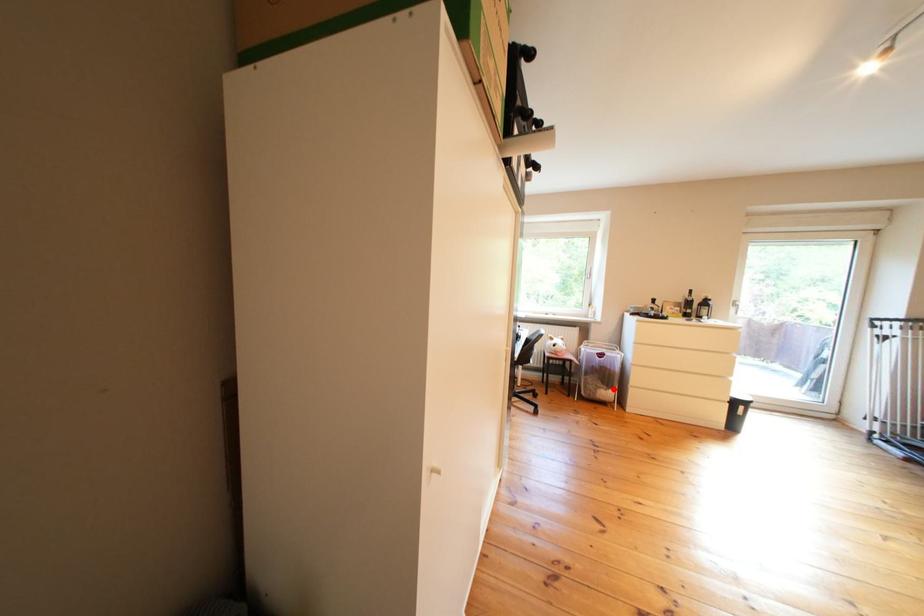
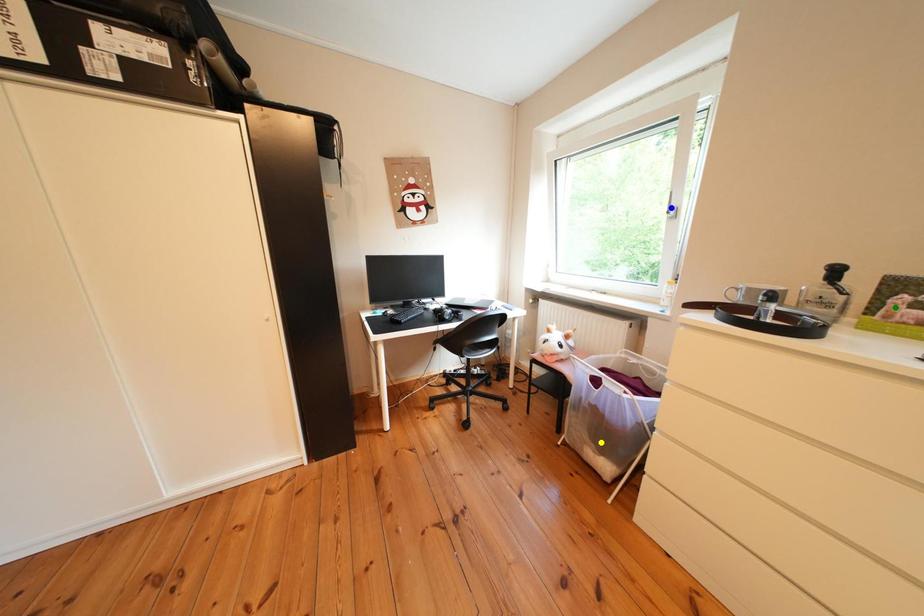
Question: I am providing you with two images of the same scene from different viewpoints. A red point is marked on the first image. You are given multiple points on the second image. In image 2, which mark is for the same physical point as the one in image 1?

Choices:
 (A) yellow point
 (B) blue point
 (C) green point

Answer: (A)